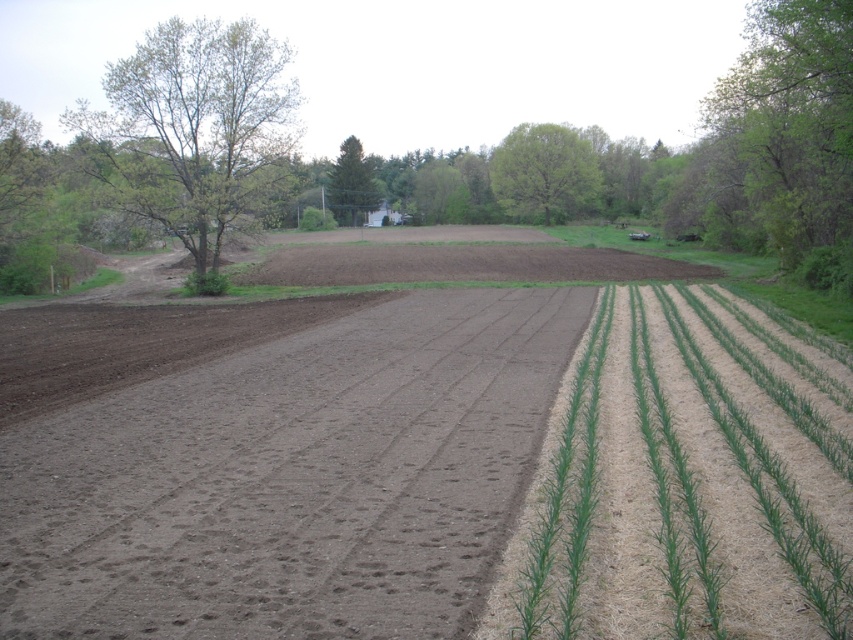
Which is in front, point (546, 480) or point (367, 204)?

Point (546, 480) is more forward.

Who is positioned more to the left, green grassy plants at right or green textured tree at center?

From the viewer's perspective, green textured tree at center appears more on the left side.

Who is more distant from viewer, (682, 342) or (340, 205)?

The point (340, 205) is more distant.

You are a GUI agent. You are given a task and a screenshot of the screen. Output one action in this format:
    pyautogui.click(x=<x>, y=<y>)
    Task: Click on the green grassy plants at right
    This screenshot has height=640, width=853.
    Given the screenshot: What is the action you would take?
    pyautogui.click(x=679, y=490)

Looking at this image, can you confirm if green leafy tree at center is positioned to the right of green textured tree at center?

Correct, you'll find green leafy tree at center to the right of green textured tree at center.

Between green leafy tree at center and green textured tree at center, which one has less height?

With less height is green leafy tree at center.

Is point (576, 173) closer to viewer compared to point (369, 166)?

Yes, it is.

The height and width of the screenshot is (640, 853). Find the location of `green leafy tree at center`. green leafy tree at center is located at coordinates tap(544, 170).

Does brown soil at center have a lesser width compared to green leafy tree at upper right?

Correct, brown soil at center's width is less than green leafy tree at upper right's.

Can you confirm if brown soil at center is positioned to the left of green leafy tree at upper right?

Yes, brown soil at center is to the left of green leafy tree at upper right.

Is point (398, 468) in front of point (827, 200)?

Yes, it is in front of point (827, 200).

The height and width of the screenshot is (640, 853). What are the coordinates of `brown soil at center` in the screenshot? It's located at (291, 477).